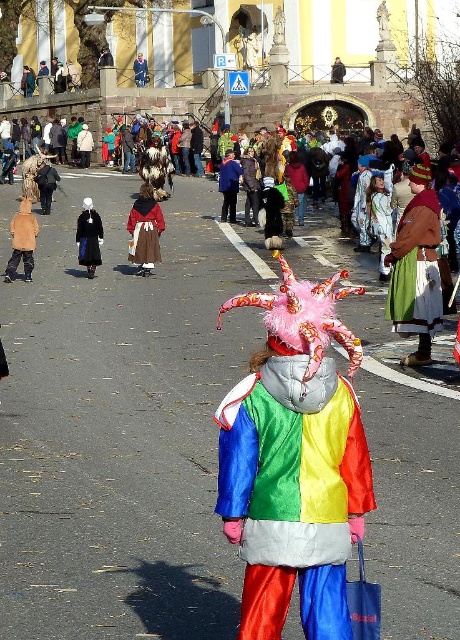
Question: Is rainbow satin costume at center positioned in front of black wool coat at center?

Choices:
 (A) no
 (B) yes

Answer: (B)

Question: Which of the following is the farthest from the observer?

Choices:
 (A) (437, 291)
 (B) (155, 218)
 (C) (91, 209)
 (D) (358, 472)

Answer: (B)

Question: Which of these objects is positioned farthest from the black wool coat at center?

Choices:
 (A) green satin skirt at center
 (B) velvet brown coat at center
 (C) rainbow satin costume at center

Answer: (C)

Question: Can you confirm if rainbow satin costume at center is positioned above velvet brown coat at center?

Choices:
 (A) no
 (B) yes

Answer: (A)

Question: Which point is closer to the camera taking this photo?

Choices:
 (A) (143, 236)
 (B) (332, 451)

Answer: (B)

Question: From the image, what is the correct spatial relationship of green satin skirt at center in relation to black wool coat at center?

Choices:
 (A) above
 (B) below

Answer: (B)